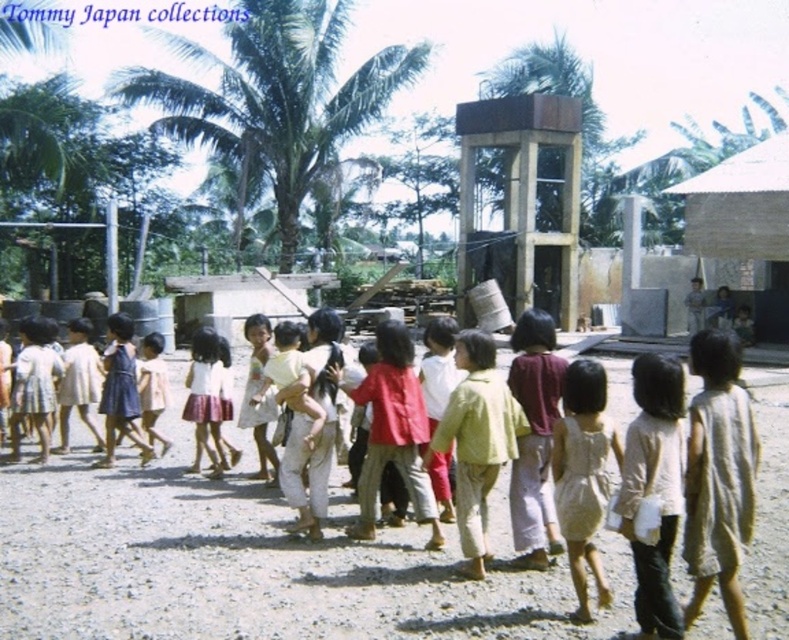
Question: Is light yellow fabric shirt at center below maroon fabric shirt at center?

Choices:
 (A) no
 (B) yes

Answer: (B)

Question: Does light beige fabric dress at lower right come behind light yellow fabric shirt at center?

Choices:
 (A) no
 (B) yes

Answer: (A)

Question: Does white cotton dress at lower right have a greater width compared to light beige cotton dress at center?

Choices:
 (A) no
 (B) yes

Answer: (B)

Question: Which is nearer to the blue dress at center?

Choices:
 (A) dirt field at center
 (B) light beige fabric dress at lower right
 (C) light beige cotton dress at center

Answer: (C)

Question: Which of the following is the closest to the observer?

Choices:
 (A) (124, 340)
 (B) (479, 378)
 (C) (526, 490)
 (D) (419, 458)

Answer: (B)

Question: Which of the following is the closest to the observer?

Choices:
 (A) (363, 497)
 (B) (728, 209)
 (C) (167, 394)

Answer: (A)